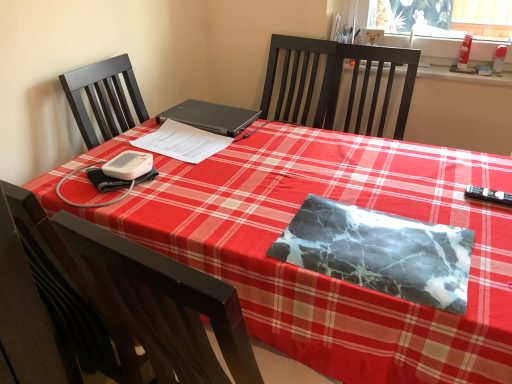
The image size is (512, 384). In order to click on free space above marble-patterned notebook at center, the second notebook in the back-to-front sequence (from a real-world perspective) in this screenshot , I will do `click(372, 238)`.